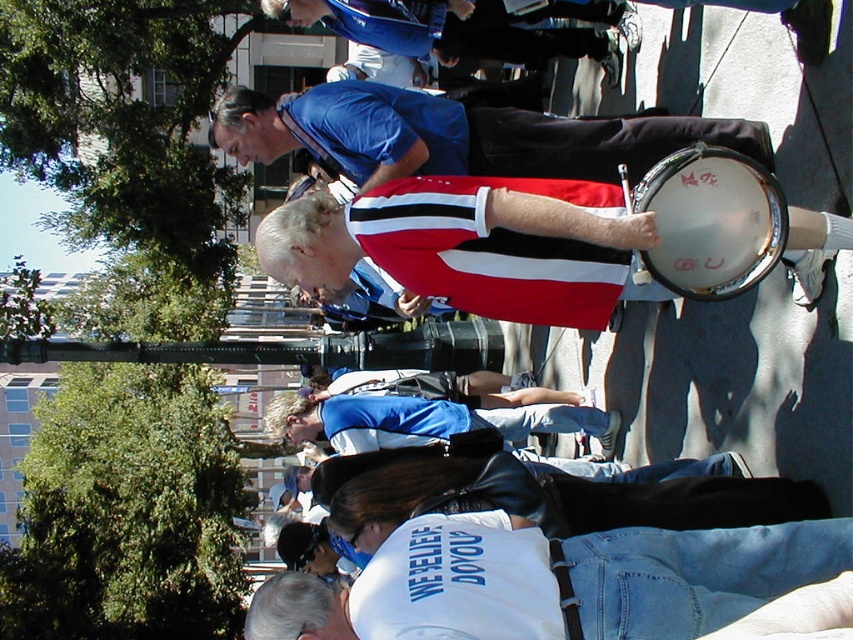
Question: Does white matte shirt at lower center appear under white drum at center?

Choices:
 (A) yes
 (B) no

Answer: (A)

Question: Which object is farther from the camera taking this photo?

Choices:
 (A) white drum at center
 (B) white matte drum at center

Answer: (B)

Question: Based on their relative distances, which object is nearer to the white matte drum at center?

Choices:
 (A) white matte shirt at lower center
 (B) white drum at center

Answer: (B)

Question: Is white matte shirt at lower center above white matte drum at center?

Choices:
 (A) yes
 (B) no

Answer: (B)

Question: Which object is farther from the camera taking this photo?

Choices:
 (A) white matte shirt at lower center
 (B) white drum at center
 (C) white matte drum at center

Answer: (C)

Question: Does white matte shirt at lower center appear over white drum at center?

Choices:
 (A) no
 (B) yes

Answer: (A)